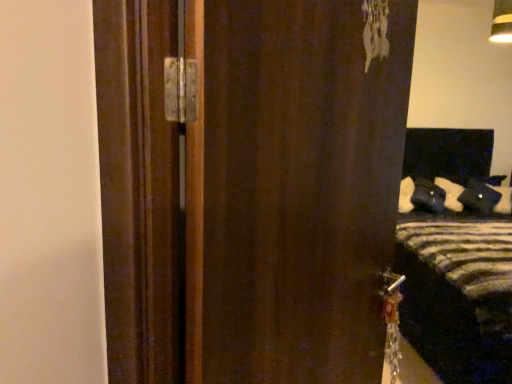
Question: Is brown matte door at center inside or outside of striped fabric bed at right?

Choices:
 (A) outside
 (B) inside

Answer: (A)

Question: Considering the relative positions of brown matte door at center and striped fabric bed at right in the image provided, is brown matte door at center to the left or to the right of striped fabric bed at right?

Choices:
 (A) left
 (B) right

Answer: (A)

Question: Is brown matte door at center wider or thinner than striped fabric bed at right?

Choices:
 (A) thin
 (B) wide

Answer: (A)

Question: Relative to brown matte door at center, is striped fabric bed at right in front or behind?

Choices:
 (A) front
 (B) behind

Answer: (B)

Question: In terms of width, does striped fabric bed at right look wider or thinner when compared to brown matte door at center?

Choices:
 (A) thin
 (B) wide

Answer: (B)

Question: Considering the positions of striped fabric bed at right and brown matte door at center in the image, is striped fabric bed at right bigger or smaller than brown matte door at center?

Choices:
 (A) small
 (B) big

Answer: (B)

Question: From a real-world perspective, is striped fabric bed at right positioned above or below brown matte door at center?

Choices:
 (A) above
 (B) below

Answer: (B)